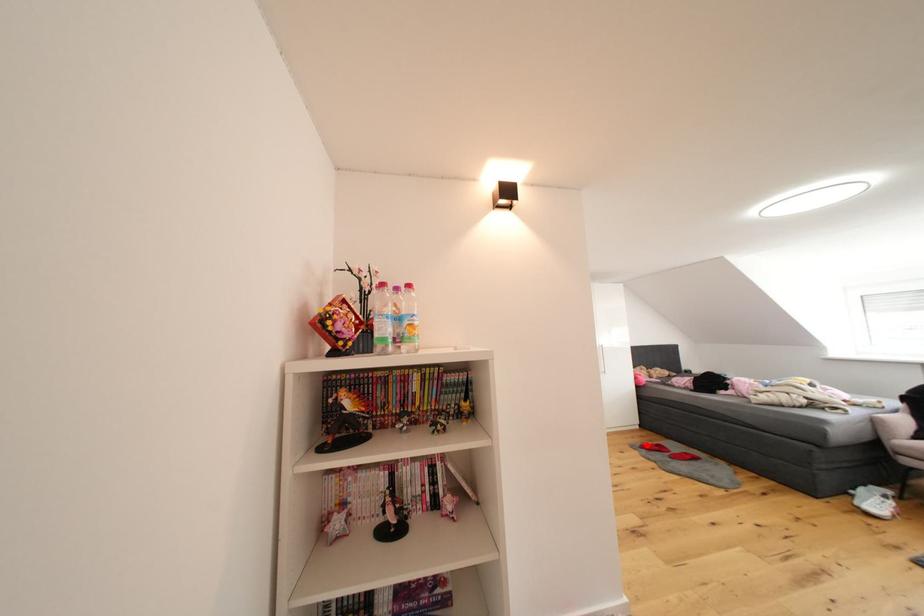
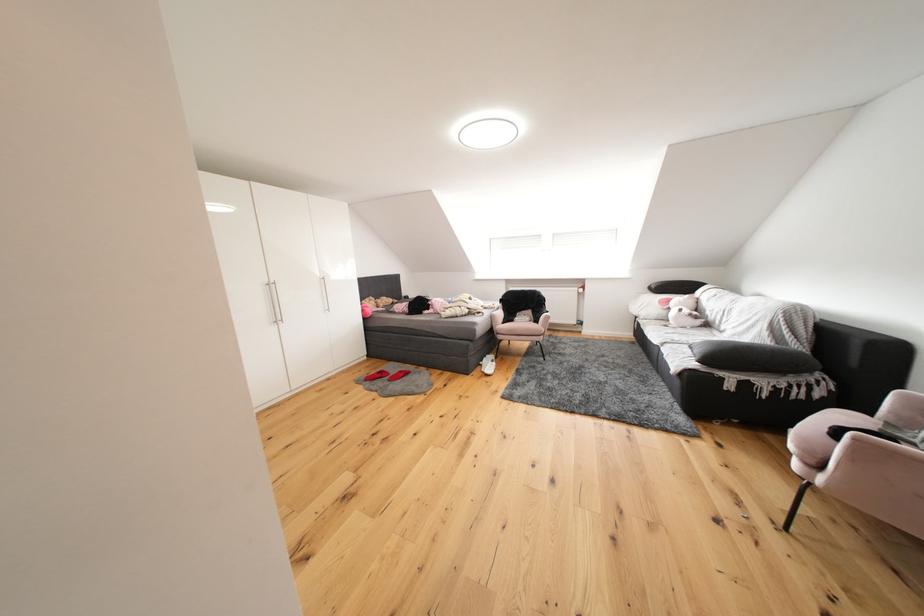
Question: I am providing you with two images of the same scene from different viewpoints. A red point is shown in image1. For the corresponding object point in image2, is it positioned nearer or farther from the camera?

Choices:
 (A) Nearer
 (B) Farther

Answer: (A)